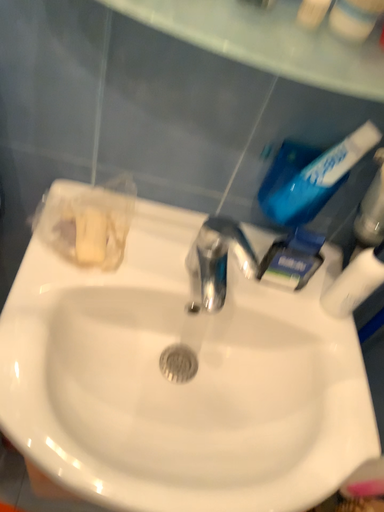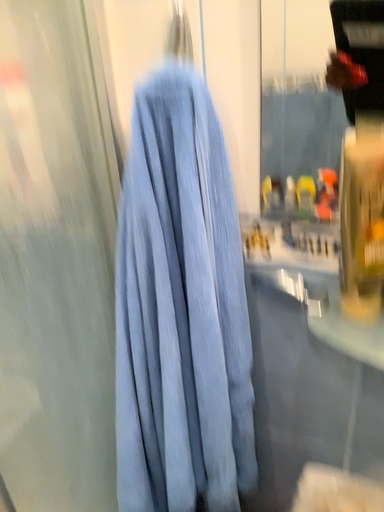
Question: Which way did the camera rotate in the video?

Choices:
 (A) rotated left
 (B) rotated right

Answer: (A)